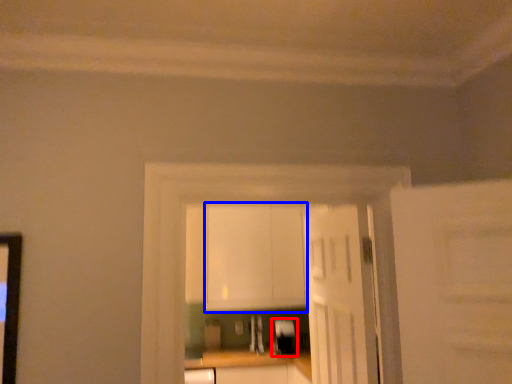
Question: Which object is further to the camera taking this photo, appliance (highlighted by a red box) or cabinetry (highlighted by a blue box)?

Choices:
 (A) appliance
 (B) cabinetry

Answer: (A)